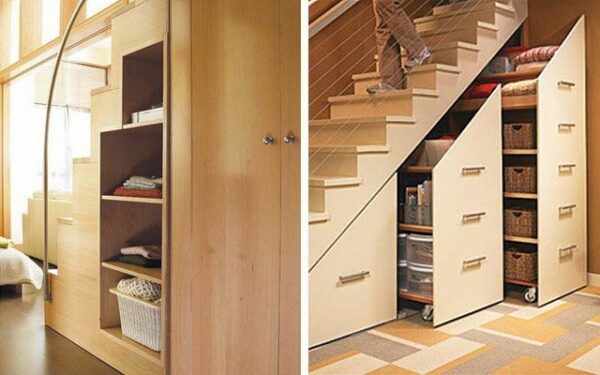
Find the location of a particular element. The image size is (600, 375). basket at bottom is located at coordinates (138, 319).